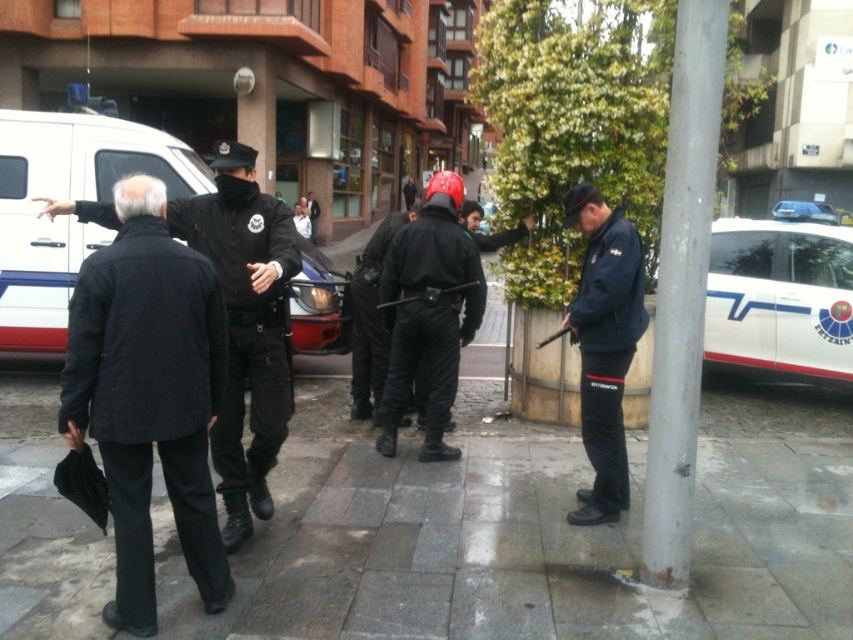
Question: Is navy blue uniform at center further to camera compared to black uniformed man at center?

Choices:
 (A) yes
 (B) no

Answer: (B)

Question: Does white glossy police car at right appear on the right side of navy blue uniform at center?

Choices:
 (A) yes
 (B) no

Answer: (A)

Question: Estimate the real-world distances between objects in this image. Which object is farther from the black uniformed man at center?

Choices:
 (A) black matte uniform at center
 (B) matte black helmet at center
 (C) navy blue uniform at center
 (D) white matte van at left

Answer: (C)

Question: Which object is positioned closest to the matte black helmet at center?

Choices:
 (A) navy blue uniform at center
 (B) black matte uniform at center
 (C) white glossy police car at right
 (D) black matte jacket at left

Answer: (B)

Question: Can you confirm if black matte jacket at left is thinner than matte black helmet at center?

Choices:
 (A) yes
 (B) no

Answer: (A)

Question: Which of these objects is positioned closest to the white glossy police car at right?

Choices:
 (A) black uniformed man at center
 (B) navy blue uniform at center
 (C) black matte jacket at left

Answer: (B)